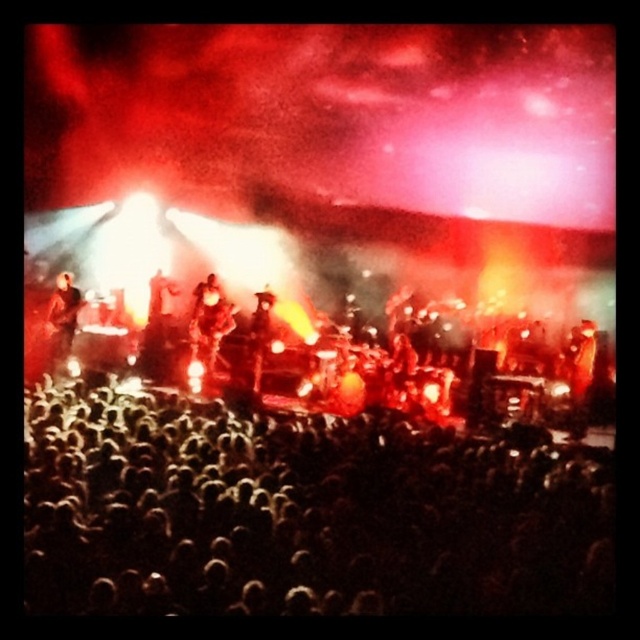
Question: Is shiny gold guitar at center below shiny black jacket at center?

Choices:
 (A) yes
 (B) no

Answer: (B)

Question: Which object is positioned farthest from the shiny black jacket at center?

Choices:
 (A) shiny gold guitar at center
 (B) black matte crowd at lower center

Answer: (B)

Question: Where is black matte crowd at lower center located in relation to shiny black jacket at center in the image?

Choices:
 (A) left
 (B) right

Answer: (B)

Question: Can you confirm if black matte crowd at lower center is bigger than shiny black jacket at center?

Choices:
 (A) no
 (B) yes

Answer: (B)

Question: Which is nearer to the black matte crowd at lower center?

Choices:
 (A) shiny gold guitar at center
 (B) black leather jacket at left

Answer: (A)

Question: Which point is farther to the camera?

Choices:
 (A) black matte crowd at lower center
 (B) shiny black jacket at center

Answer: (B)